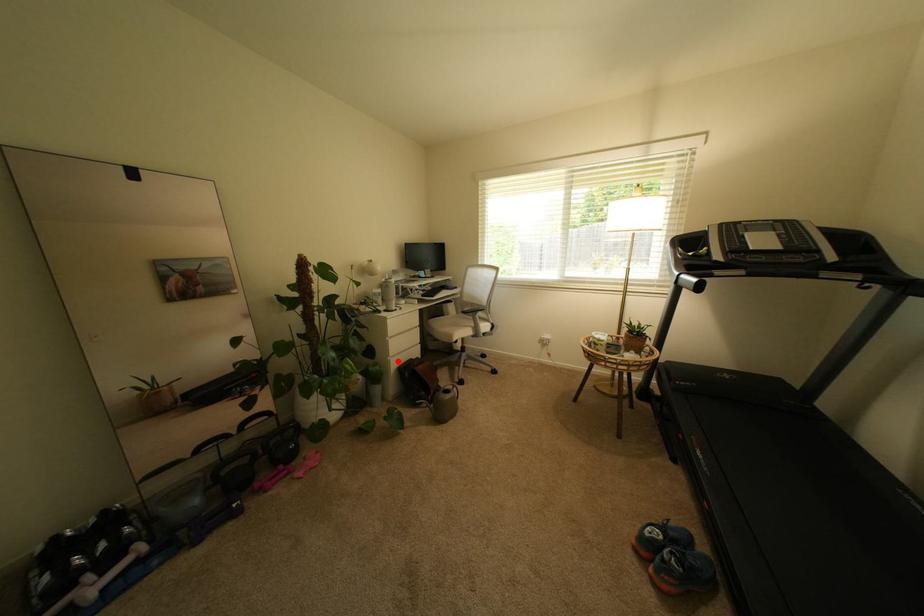
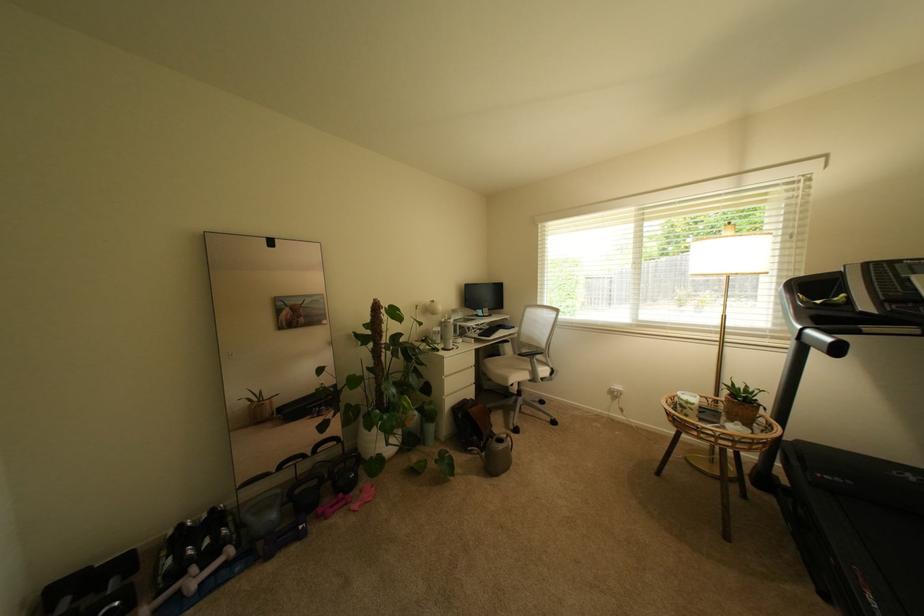
Question: I am providing you with two images of the same scene from different viewpoints. Image1 has a red point marked. In image2, the corresponding 3D location appears at what relative position? Reply with the corresponding letter.

Choices:
 (A) Closer
 (B) Farther

Answer: (B)